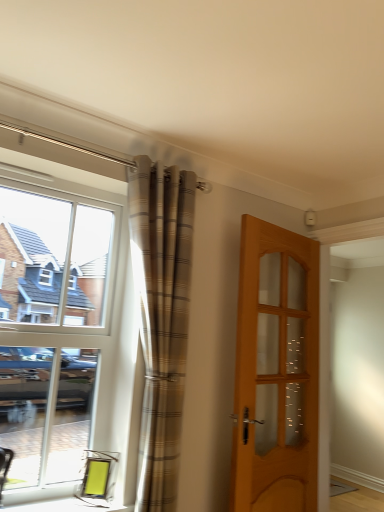
Question: Is plaid fabric curtain at left closer to camera compared to matte glass window sill at lower left?

Choices:
 (A) yes
 (B) no

Answer: (B)

Question: From the image's perspective, does plaid fabric curtain at left appear higher than matte glass window sill at lower left?

Choices:
 (A) no
 (B) yes

Answer: (B)

Question: Can you confirm if plaid fabric curtain at left is shorter than matte glass window sill at lower left?

Choices:
 (A) no
 (B) yes

Answer: (A)

Question: Does plaid fabric curtain at left have a greater width compared to matte glass window sill at lower left?

Choices:
 (A) no
 (B) yes

Answer: (A)

Question: Does plaid fabric curtain at left have a smaller size compared to matte glass window sill at lower left?

Choices:
 (A) no
 (B) yes

Answer: (A)

Question: Is plaid fabric curtain at left with matte glass window sill at lower left?

Choices:
 (A) yes
 (B) no

Answer: (B)

Question: From a real-world perspective, does white glass window at left stand above wooden glass door at right?

Choices:
 (A) no
 (B) yes

Answer: (B)

Question: Does white glass window at left contain wooden glass door at right?

Choices:
 (A) no
 (B) yes

Answer: (A)

Question: Can you confirm if white glass window at left is positioned to the left of wooden glass door at right?

Choices:
 (A) no
 (B) yes

Answer: (B)

Question: Can you confirm if white glass window at left is thinner than wooden glass door at right?

Choices:
 (A) yes
 (B) no

Answer: (A)

Question: From a real-world perspective, does white glass window at left sit lower than wooden glass door at right?

Choices:
 (A) no
 (B) yes

Answer: (A)

Question: Is the depth of white glass window at left greater than that of wooden glass door at right?

Choices:
 (A) no
 (B) yes

Answer: (A)

Question: Is white glass window at left beside plaid fabric curtain at left?

Choices:
 (A) yes
 (B) no

Answer: (B)